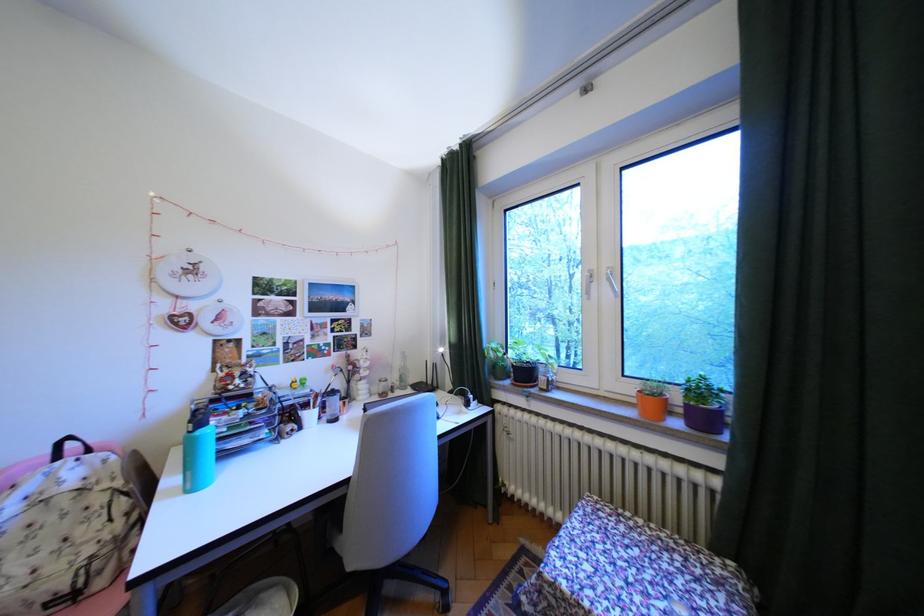
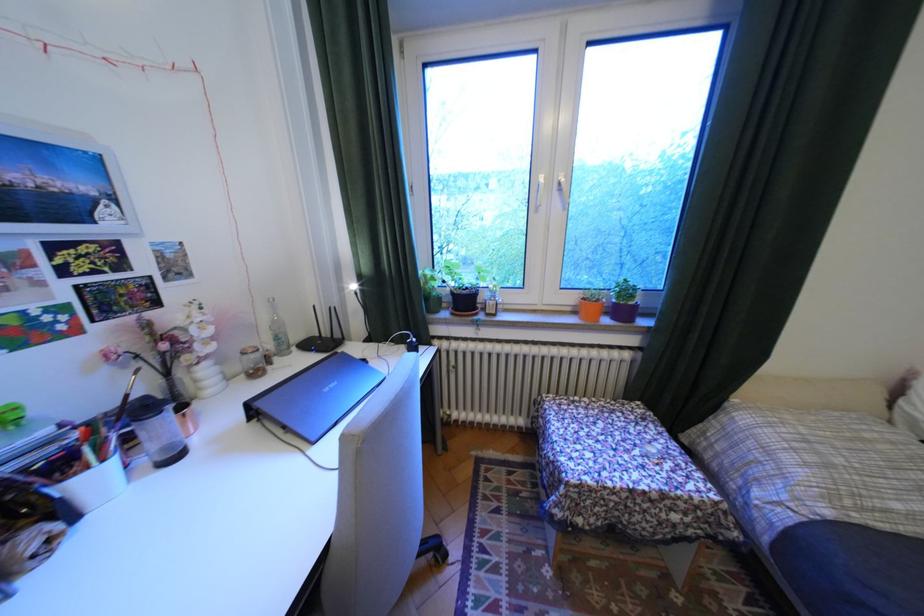
Find the pixel in the second image that matches the point at 517,369 in the first image.

(451, 299)